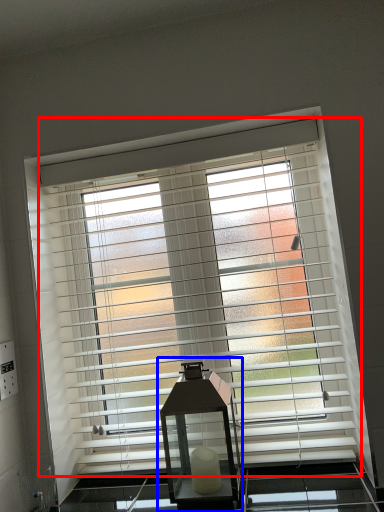
Question: Among these objects, which one is nearest to the camera, window blind (highlighted by a red box) or table lamp (highlighted by a blue box)?

Choices:
 (A) window blind
 (B) table lamp

Answer: (B)